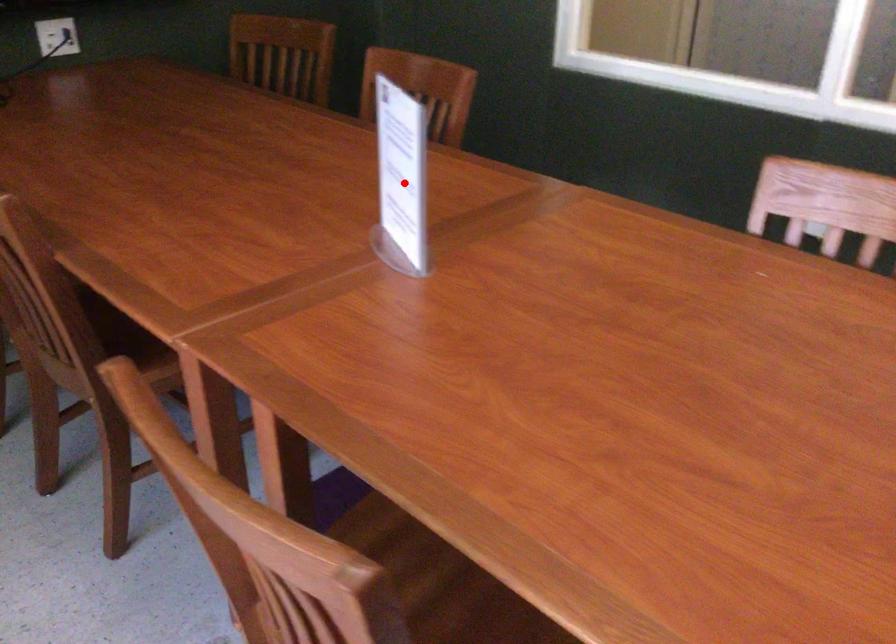
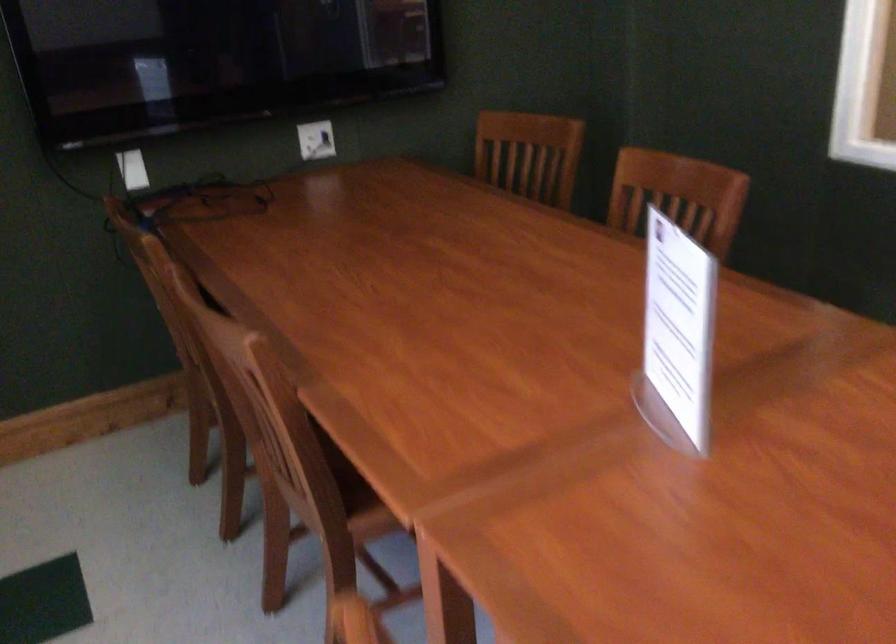
Question: I am providing you with two images of the same scene from different viewpoints. Given a red point in image1, look at the same physical point in image2. Is it:

Choices:
 (A) Closer to the viewpoint
 (B) Farther from the viewpoint

Answer: (A)